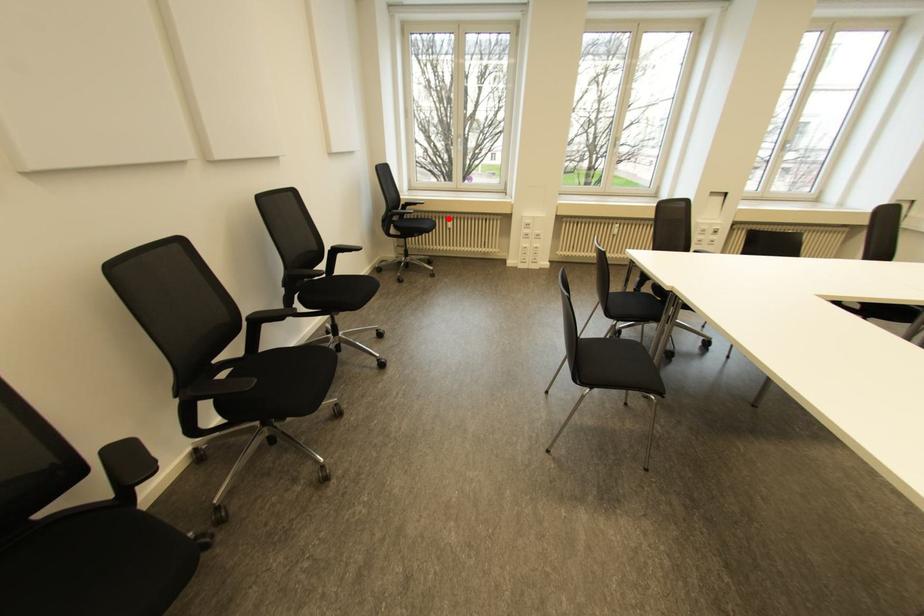
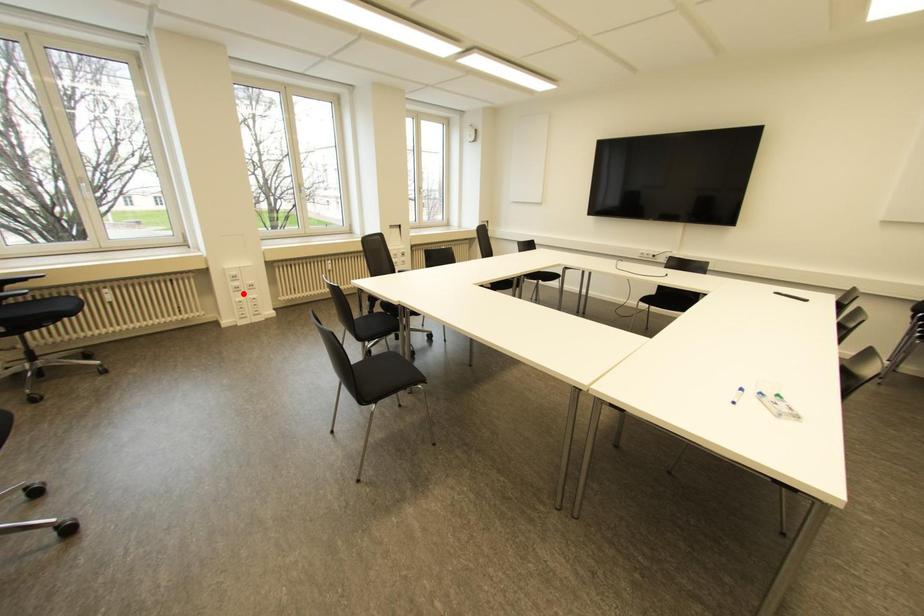
I am providing you with two images of the same scene from different viewpoints. A red point is marked on the first image and another point is marked on the second image. Is the red point in image1 aligned with the point shown in image2?

No